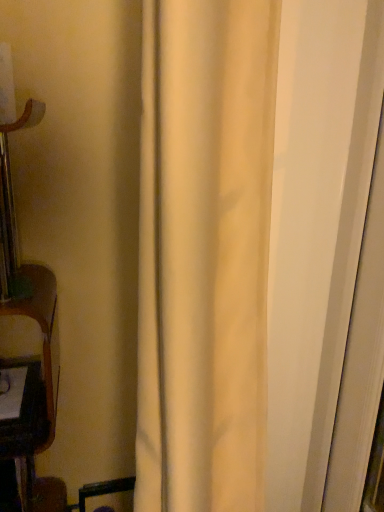
Question: In the image, is white glossy door at right positioned in front of or behind beige fabric curtain at center?

Choices:
 (A) front
 (B) behind

Answer: (B)

Question: In the image, is white glossy door at right on the left side or the right side of beige fabric curtain at center?

Choices:
 (A) left
 (B) right

Answer: (B)

Question: Is point (297, 392) positioned closer to the camera than point (236, 344)?

Choices:
 (A) farther
 (B) closer

Answer: (A)

Question: In terms of size, does beige fabric curtain at center appear bigger or smaller than white glossy door at right?

Choices:
 (A) big
 (B) small

Answer: (A)

Question: Looking at their shapes, would you say beige fabric curtain at center is wider or thinner than white glossy door at right?

Choices:
 (A) wide
 (B) thin

Answer: (A)

Question: From their relative heights in the image, would you say beige fabric curtain at center is taller or shorter than white glossy door at right?

Choices:
 (A) short
 (B) tall

Answer: (B)

Question: From a real-world perspective, is beige fabric curtain at center physically located above or below white glossy door at right?

Choices:
 (A) above
 (B) below

Answer: (B)